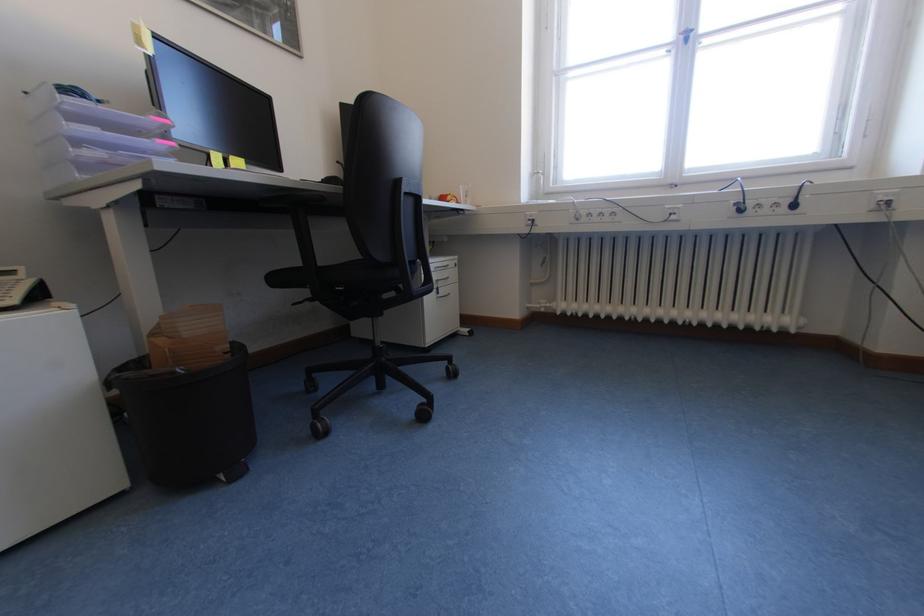
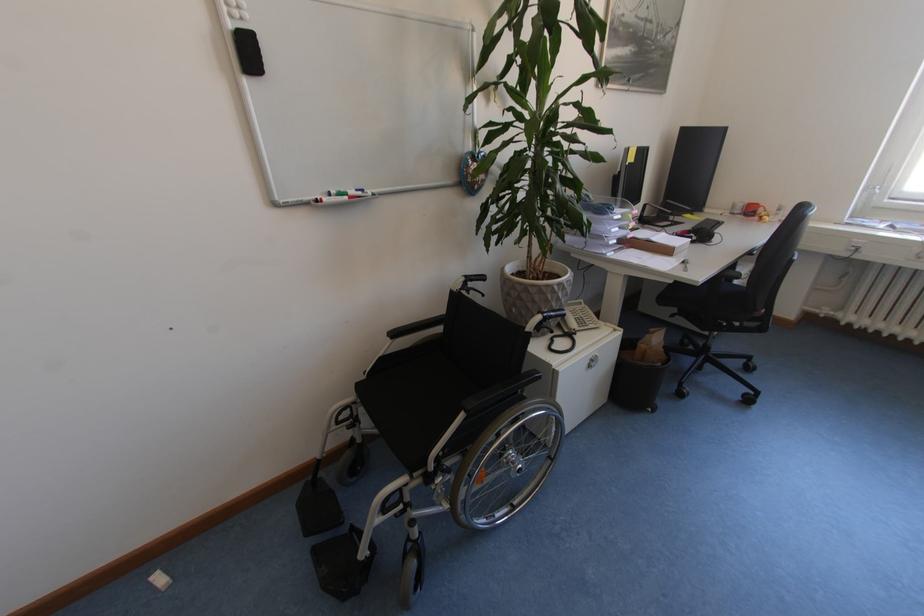
The images are taken continuously from a first-person perspective. In which direction are you moving?

The cameraman walked toward left, backward.